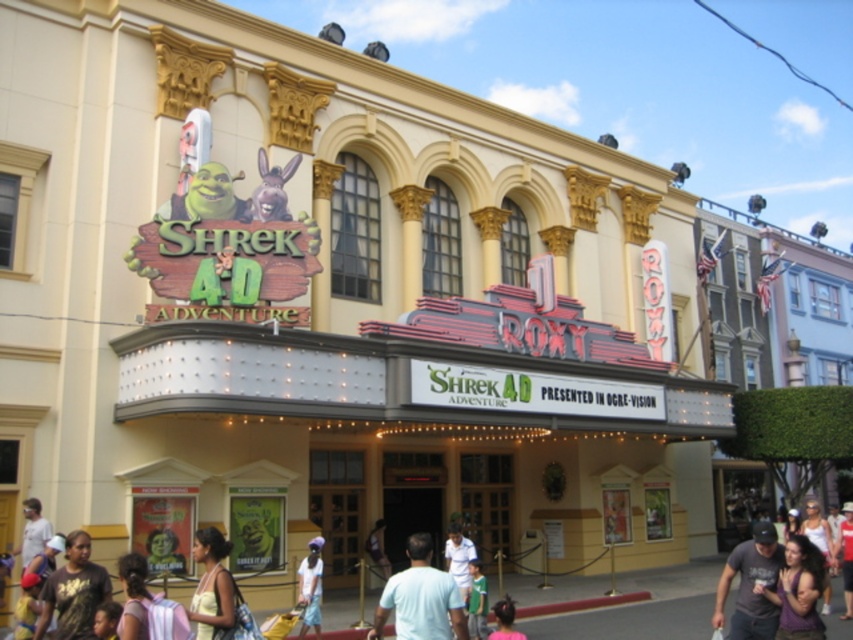
Question: Where is light blue shirt at lower left located in relation to light blue shirt at center in the image?

Choices:
 (A) above
 (B) below

Answer: (A)

Question: Which point appears closest to the camera in this image?

Choices:
 (A) [312, 611]
 (B) [799, 547]
 (C) [67, 577]

Answer: (C)

Question: Does light blue denim shorts at center have a smaller size compared to red shirt at center?

Choices:
 (A) yes
 (B) no

Answer: (A)

Question: Which point is closer to the camera?

Choices:
 (A) light blue shirt at lower left
 (B) white cotton shirt at center

Answer: (A)

Question: Which point is closer to the camera taking this photo?

Choices:
 (A) (718, 612)
 (B) (796, 609)

Answer: (B)

Question: Is light blue denim shorts at center positioned before red shirt at center?

Choices:
 (A) no
 (B) yes

Answer: (B)